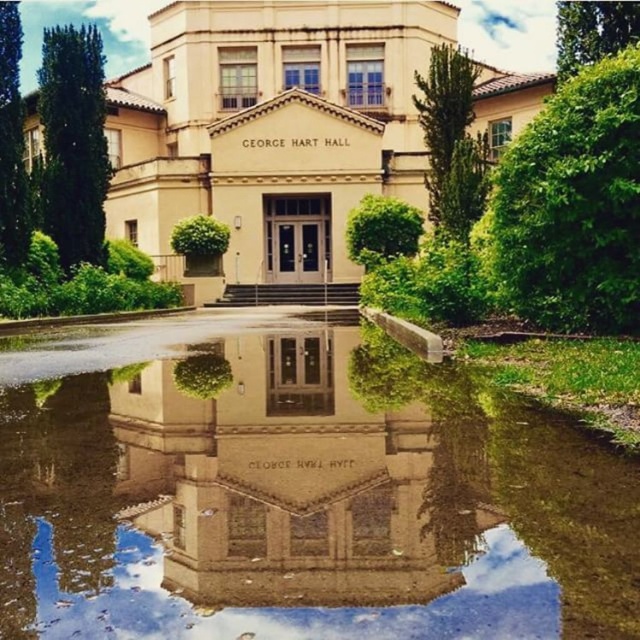
Question: Observing the image, what is the correct spatial positioning of clear glass water at center in reference to beige stone building at center?

Choices:
 (A) right
 (B) left

Answer: (A)

Question: Which point appears closest to the camera in this image?

Choices:
 (A) (42, 500)
 (B) (385, 44)

Answer: (A)

Question: Which of the following is the closest to the observer?

Choices:
 (A) (115, 186)
 (B) (467, 460)

Answer: (B)

Question: Is the position of clear glass water at center more distant than that of beige stone building at center?

Choices:
 (A) no
 (B) yes

Answer: (A)

Question: In this image, where is clear glass water at center located relative to beige stone building at center?

Choices:
 (A) left
 (B) right

Answer: (B)

Question: Which of the following is the closest to the observer?

Choices:
 (A) beige stone building at center
 (B) clear glass water at center

Answer: (B)